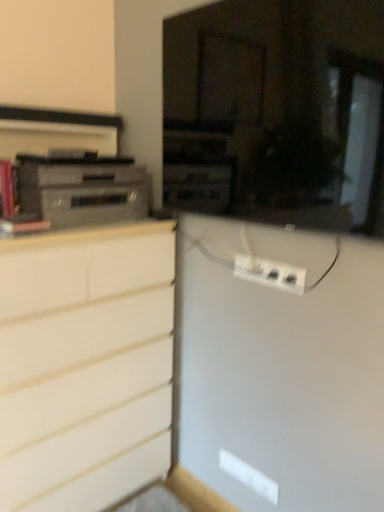
This screenshot has height=512, width=384. Describe the element at coordinates (85, 365) in the screenshot. I see `white matte chest of drawers at left` at that location.

What are the coordinates of `white matte chest of drawers at left` in the screenshot? It's located at (85, 365).

What are the coordinates of `satin silver stereo at left` in the screenshot? It's located at (82, 190).

From a real-world perspective, which is physically below, white plastic power strip at center or satin silver stereo at left?

In real-world perspective, white plastic power strip at center is lower.

Does white plastic power strip at center have a greater height compared to satin silver stereo at left?

No.

Is white plastic power strip at center spatially inside satin silver stereo at left, or outside of it?

white plastic power strip at center exists outside the volume of satin silver stereo at left.

Would you say white plastic power strip at center is a long distance from satin silver stereo at left?

That's not correct — white plastic power strip at center is a little close to satin silver stereo at left.

Which of these two, white matte chest of drawers at left or white plastic power strip at center, stands shorter?

Standing shorter between the two is white plastic power strip at center.

Is point (91, 334) positioned behind point (292, 287)?

Yes, it is behind point (292, 287).

Can you confirm if satin silver stereo at left is taller than white matte chest of drawers at left?

No, satin silver stereo at left is not taller than white matte chest of drawers at left.

Considering the relative sizes of satin silver stereo at left and white matte chest of drawers at left in the image provided, is satin silver stereo at left thinner than white matte chest of drawers at left?

Indeed, satin silver stereo at left has a lesser width compared to white matte chest of drawers at left.

From a real-world perspective, is satin silver stereo at left physically located above or below white matte chest of drawers at left?

satin silver stereo at left is situated higher than white matte chest of drawers at left in the real world.

Consider the image. Is white matte chest of drawers at left at the back of satin silver stereo at left?

satin silver stereo at left is not turned away from white matte chest of drawers at left.

Is white matte chest of drawers at left situated inside satin silver stereo at left or outside?

white matte chest of drawers at left cannot be found inside satin silver stereo at left.

Between white matte chest of drawers at left and satin silver stereo at left, which one has more height?

white matte chest of drawers at left is taller.

Is white matte chest of drawers at left next to satin silver stereo at left and touching it?

No, white matte chest of drawers at left is not beside satin silver stereo at left.

Is white matte chest of drawers at left at the left side of satin silver stereo at left?

Indeed, white matte chest of drawers at left is positioned on the left side of satin silver stereo at left.

Between satin silver stereo at left and white plastic power strip at center, which one appears on the right side from the viewer's perspective?

white plastic power strip at center is more to the right.

What's the angular difference between satin silver stereo at left and white plastic power strip at center's facing directions?

The angle between the facing direction of satin silver stereo at left and the facing direction of white plastic power strip at center is 88.5 degrees.

Is satin silver stereo at left located outside white plastic power strip at center?

Yes.

Does satin silver stereo at left have a greater height compared to white plastic power strip at center?

Yes.

Could you tell me if white plastic power strip at center is turned towards white matte chest of drawers at left?

No.

Is the depth of white plastic power strip at center greater than that of white matte chest of drawers at left?

Yes, white plastic power strip at center is behind white matte chest of drawers at left.

Considering the sizes of objects white plastic power strip at center and white matte chest of drawers at left in the image provided, who is bigger, white plastic power strip at center or white matte chest of drawers at left?

Bigger between the two is white matte chest of drawers at left.

How many degrees apart are the facing directions of white plastic power strip at center and white matte chest of drawers at left?

The angle between the facing direction of white plastic power strip at center and the facing direction of white matte chest of drawers at left is 88.5 degrees.

Identify the location of electric outlet below the satin silver stereo at left (from the image's perspective). Image resolution: width=384 pixels, height=512 pixels. (270, 273).

This screenshot has height=512, width=384. Identify the location of electric outlet lying above the white matte chest of drawers at left (from the image's perspective). (270, 273).

Looking at the image, which one is located closer to white plastic power strip at center, white matte chest of drawers at left or satin silver stereo at left?

Based on the image, satin silver stereo at left appears to be nearer to white plastic power strip at center.

From the image, which object appears to be farther from white matte chest of drawers at left, white plastic power strip at center or satin silver stereo at left?

white plastic power strip at center is further to white matte chest of drawers at left.

Which object lies nearer to the anchor point white matte chest of drawers at left, satin silver stereo at left or white plastic power strip at center?

satin silver stereo at left.

From the image, which object appears to be nearer to satin silver stereo at left, white plastic power strip at center or white matte chest of drawers at left?

white matte chest of drawers at left is positioned closer to the anchor satin silver stereo at left.

Estimate the real-world distances between objects in this image. Which object is closer to satin silver stereo at left, white matte chest of drawers at left or white plastic power strip at center?

Among the two, white matte chest of drawers at left is located nearer to satin silver stereo at left.

From the image, which object appears to be nearer to white plastic power strip at center, satin silver stereo at left or white matte chest of drawers at left?

satin silver stereo at left lies closer to white plastic power strip at center than the other object.

Identify the location of home appliance between white matte chest of drawers at left and white plastic power strip at center. The height and width of the screenshot is (512, 384). (82, 190).